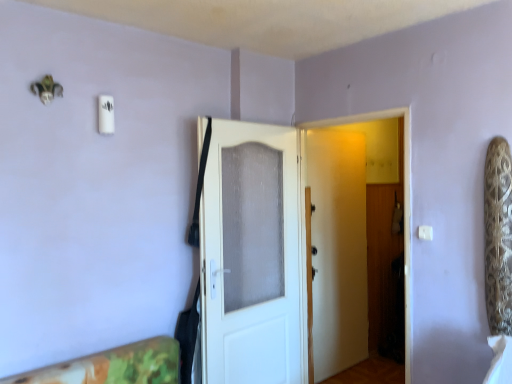
Question: Is white textured door at center, arranged as the first door when viewed from the left, in front of or behind white matte door at center, which appears as the second door when viewed from the left, in the image?

Choices:
 (A) behind
 (B) front

Answer: (A)

Question: Considering the positions of white textured door at center, arranged as the first door when viewed from the left, and white matte door at center, the 1th door when ordered from right to left, in the image, is white textured door at center, arranged as the first door when viewed from the left, wider or thinner than white matte door at center, the 1th door when ordered from right to left,?

Choices:
 (A) thin
 (B) wide

Answer: (A)

Question: Which of these objects is positioned closest to the white textured door at center, arranged as the first door when viewed from the left?

Choices:
 (A) white plastic light switch at upper right
 (B) white matte door at center, which appears as the second door when viewed from the left

Answer: (B)

Question: Which object is the farthest from the white matte door at center, the 1th door when ordered from right to left?

Choices:
 (A) white textured door at center, which ranks as the second door in right-to-left order
 (B) white plastic light switch at upper right

Answer: (B)